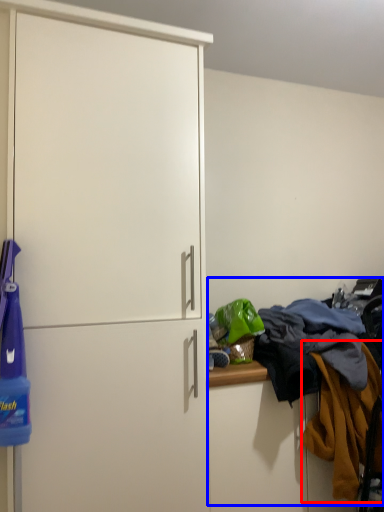
Question: Among these objects, which one is nearest to the camera, clothing (highlighted by a red box) or laundry (highlighted by a blue box)?

Choices:
 (A) clothing
 (B) laundry

Answer: (A)